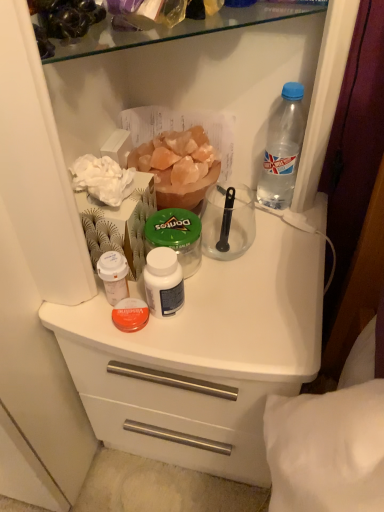
Locate an element on the screen. vacant area that lies between transparent plastic bottle at upper right, the 2th bottle ordered from the bottom, and transparent plastic spoon at center is located at coordinates (252, 222).